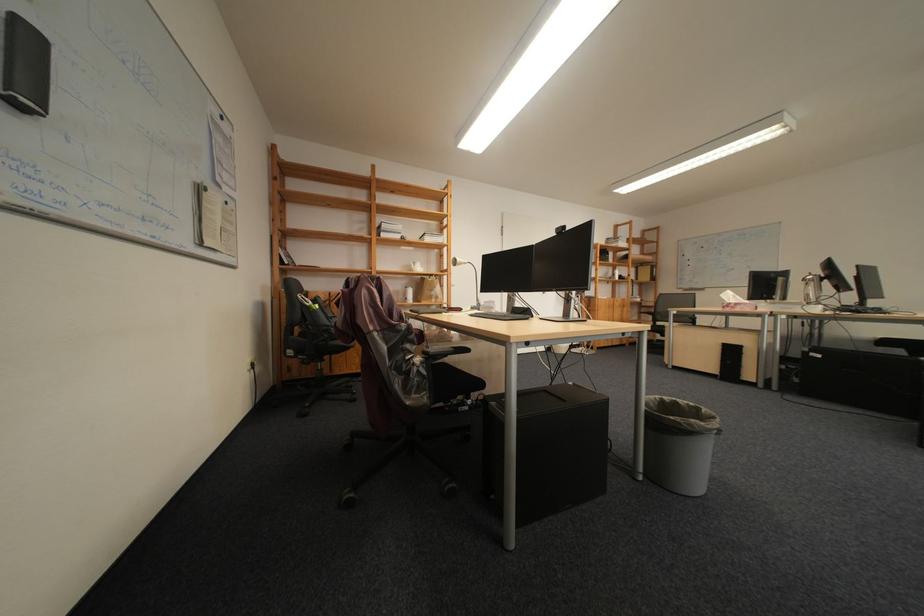
The height and width of the screenshot is (616, 924). Describe the element at coordinates (810, 288) in the screenshot. I see `the metal pitcher handle` at that location.